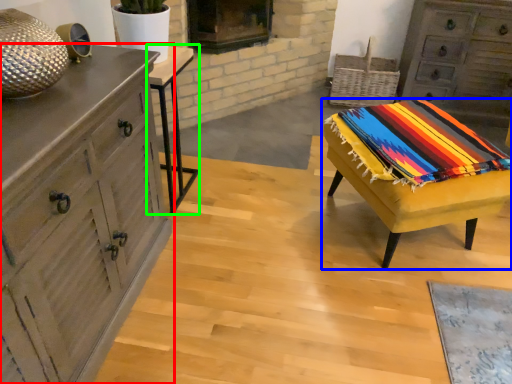
Question: Which object is the farthest from chest of drawers (highlighted by a red box)? Choose among these: table (highlighted by a blue box) or table (highlighted by a green box).

Choices:
 (A) table
 (B) table

Answer: (A)